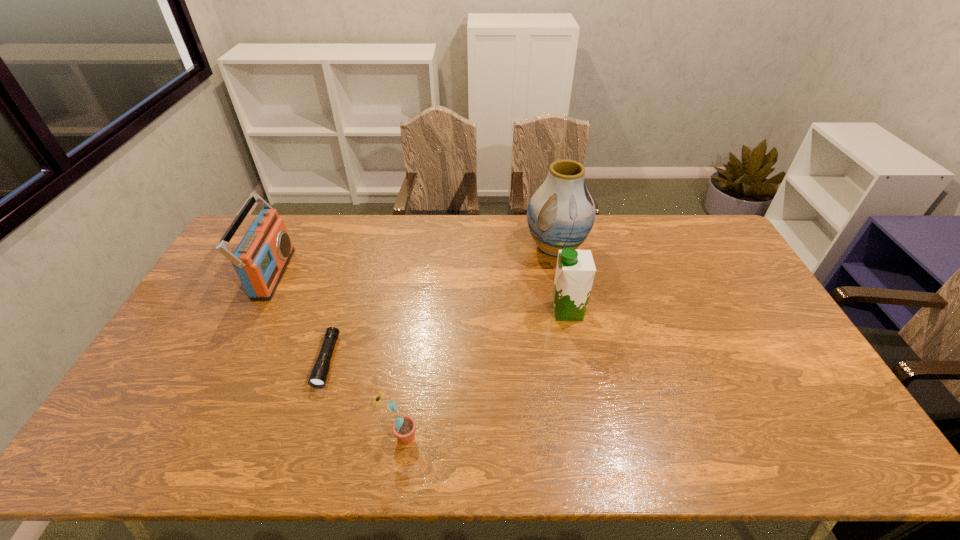
Locate an element on the screen. This screenshot has height=540, width=960. free space located 0.220m on the front-facing side of the soya milk is located at coordinates (480, 312).

Identify the location of vacant space situated 0.230m on the front-facing side of the leftmost object. (354, 274).

Locate an element on the screen. The width and height of the screenshot is (960, 540). free space located on the flower of the second shortest object is located at coordinates 451,437.

Locate an element on the screen. The image size is (960, 540). vacant space located 0.140m at the lens end of the shortest object is located at coordinates (303, 438).

Locate an element on the screen. The height and width of the screenshot is (540, 960). vase positioned at the far edge is located at coordinates (561, 213).

Identify the location of radio receiver present at the far edge. This screenshot has height=540, width=960. (262, 256).

The height and width of the screenshot is (540, 960). I want to click on object present at the near edge, so click(404, 427).

What are the coordinates of `object located in the left edge section of the desktop` in the screenshot? It's located at (262, 256).

You are a GUI agent. You are given a task and a screenshot of the screen. Output one action in this format:
    pyautogui.click(x=<x>, y=<y>)
    Task: Click on the object located in the far left corner section of the desktop
    The width and height of the screenshot is (960, 540).
    Given the screenshot: What is the action you would take?
    [x=262, y=256]

In the image, there is a desktop. Identify the location of free space at the far edge. The height and width of the screenshot is (540, 960). (396, 225).